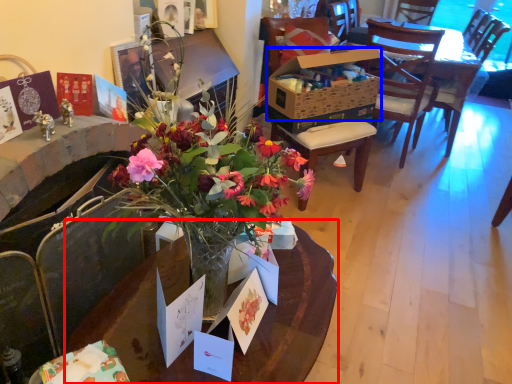
Question: Among these objects, which one is farthest to the camera, kitchen & dining room table (highlighted by a red box) or box (highlighted by a blue box)?

Choices:
 (A) kitchen & dining room table
 (B) box

Answer: (B)